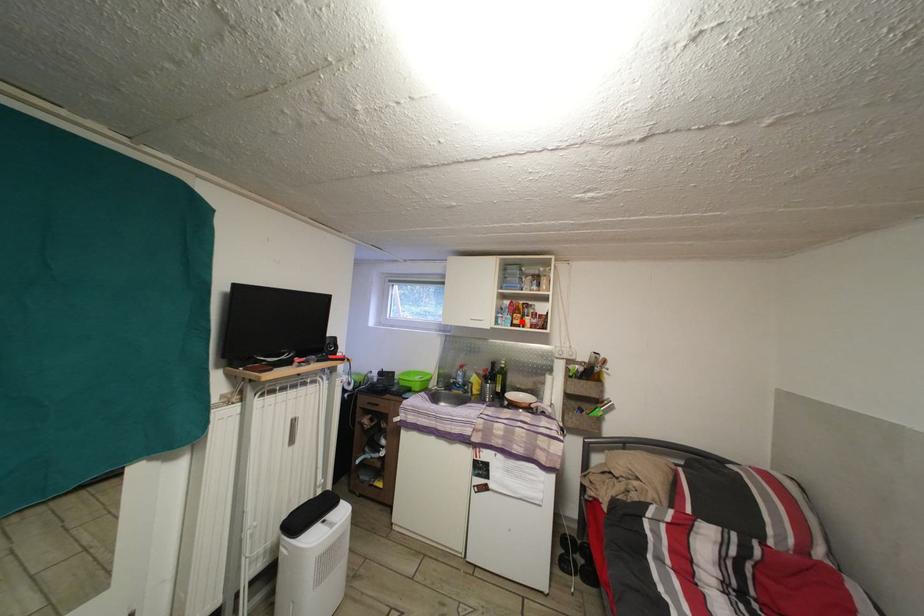
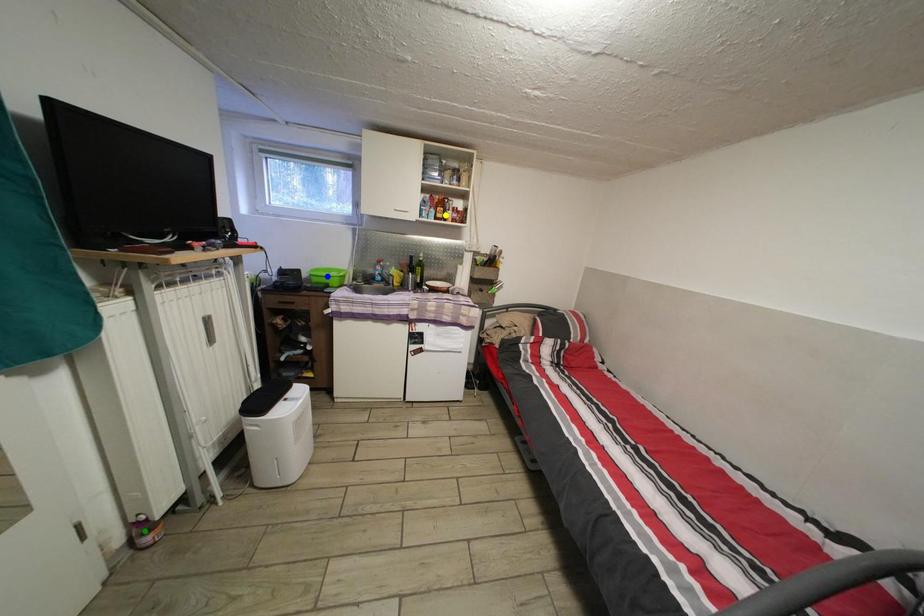
Question: I am providing you with two images of the same scene from different viewpoints. A red point is marked on the first image. You are given multiple points on the second image. Which mark in image 2 goes with the point in image 1?

Choices:
 (A) green point
 (B) blue point
 (C) yellow point

Answer: (C)